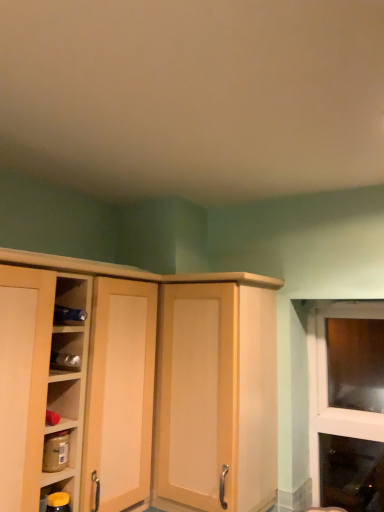
Describe the element at coordinates (196, 393) in the screenshot. Image resolution: width=384 pixels, height=512 pixels. I see `matte wood cabinet at center` at that location.

What are the coordinates of `yellow matte jar at lower left, the second shelf positioned from the top` in the screenshot? It's located at (54, 499).

Considering the relative sizes of yellow matte jar at lower left, the first shelf when ordered from bottom to top, and matte wood cupboard at left in the image provided, is yellow matte jar at lower left, the first shelf when ordered from bottom to top, smaller than matte wood cupboard at left?

Yes, yellow matte jar at lower left, the first shelf when ordered from bottom to top, is smaller than matte wood cupboard at left.

From a real-world perspective, which object stands above the other?

In real-world perspective, matte wood cupboard at left is above.

Is yellow matte jar at lower left, the second shelf positioned from the top, facing towards matte wood cupboard at left?

Yes, yellow matte jar at lower left, the second shelf positioned from the top, is aimed at matte wood cupboard at left.

Considering the relative sizes of yellow matte jar at lower left, the second shelf positioned from the top, and matte wood cupboard at left in the image provided, is yellow matte jar at lower left, the second shelf positioned from the top, thinner than matte wood cupboard at left?

Yes, yellow matte jar at lower left, the second shelf positioned from the top, is thinner than matte wood cupboard at left.

Considering the points (182, 501) and (65, 496), which point is in front, point (182, 501) or point (65, 496)?

Positioned in front is point (65, 496).

Is matte wood cabinet at center looking in the opposite direction of yellow matte jar at lower left, the first shelf when ordered from bottom to top?

No, matte wood cabinet at center is not facing the opposite direction of yellow matte jar at lower left, the first shelf when ordered from bottom to top.

Can you see matte wood cabinet at center touching yellow matte jar at lower left, the second shelf positioned from the top?

No.

Would you say matte wood cabinet at center is to the left or to the right of yellow matte jar at lower left, the second shelf positioned from the top, in the picture?

Clearly, matte wood cabinet at center is on the right of yellow matte jar at lower left, the second shelf positioned from the top, in the image.

Is matte wood cupboard at left facing away from yellow matte jar at lower left, the first shelf when ordered from bottom to top?

No, matte wood cupboard at left is not facing away from yellow matte jar at lower left, the first shelf when ordered from bottom to top.

Between matte wood cupboard at left and yellow matte jar at lower left, the second shelf positioned from the top, which one is positioned in front?

matte wood cupboard at left is more forward.

Considering the relative sizes of matte wood cupboard at left and yellow matte jar at lower left, the first shelf when ordered from bottom to top, in the image provided, is matte wood cupboard at left taller than yellow matte jar at lower left, the first shelf when ordered from bottom to top,?

Indeed, matte wood cupboard at left has a greater height compared to yellow matte jar at lower left, the first shelf when ordered from bottom to top.

Does matte brown jar at lower left, arranged as the 1th shelf when viewed from the top, have a smaller size compared to matte wood cupboard at left?

Yes, matte brown jar at lower left, arranged as the 1th shelf when viewed from the top, is smaller than matte wood cupboard at left.

Considering the relative positions of matte brown jar at lower left, the second shelf in the bottom-to-top sequence, and matte wood cupboard at left in the image provided, is matte brown jar at lower left, the second shelf in the bottom-to-top sequence, behind matte wood cupboard at left?

Yes, it is.

How much distance is there between matte brown jar at lower left, arranged as the 1th shelf when viewed from the top, and matte wood cupboard at left?

The distance of matte brown jar at lower left, arranged as the 1th shelf when viewed from the top, from matte wood cupboard at left is 14.16 inches.

Is matte brown jar at lower left, arranged as the 1th shelf when viewed from the top, not within matte wood cupboard at left?

Actually, matte brown jar at lower left, arranged as the 1th shelf when viewed from the top, is within matte wood cupboard at left.

From the picture: Between matte wood cabinet at center and matte brown jar at lower left, the second shelf in the bottom-to-top sequence, which one appears on the left side from the viewer's perspective?

From the viewer's perspective, matte brown jar at lower left, the second shelf in the bottom-to-top sequence, appears more on the left side.

Considering the sizes of objects matte wood cabinet at center and matte brown jar at lower left, the second shelf in the bottom-to-top sequence, in the image provided, who is smaller, matte wood cabinet at center or matte brown jar at lower left, the second shelf in the bottom-to-top sequence,?

matte brown jar at lower left, the second shelf in the bottom-to-top sequence.

Considering the relative sizes of matte wood cabinet at center and matte brown jar at lower left, the second shelf in the bottom-to-top sequence, in the image provided, is matte wood cabinet at center wider than matte brown jar at lower left, the second shelf in the bottom-to-top sequence,?

Indeed, matte wood cabinet at center has a greater width compared to matte brown jar at lower left, the second shelf in the bottom-to-top sequence.

Would you say matte wood cabinet at center contains matte brown jar at lower left, arranged as the 1th shelf when viewed from the top?

No, matte wood cabinet at center does not contain matte brown jar at lower left, arranged as the 1th shelf when viewed from the top.

Who is smaller, matte wood cupboard at left or matte wood cabinet at center?

Smaller between the two is matte wood cabinet at center.

Is matte wood cupboard at left not within matte wood cabinet at center?

matte wood cupboard at left is positioned outside matte wood cabinet at center.

The height and width of the screenshot is (512, 384). I want to click on screen door located behind the matte wood cupboard at left, so click(x=196, y=393).

From the image's perspective, who appears lower, matte brown jar at lower left, the second shelf in the bottom-to-top sequence, or matte wood cabinet at center?

matte brown jar at lower left, the second shelf in the bottom-to-top sequence, from the image's perspective.

Between matte brown jar at lower left, arranged as the 1th shelf when viewed from the top, and matte wood cabinet at center, which one appears on the right side from the viewer's perspective?

matte wood cabinet at center.

Is matte brown jar at lower left, the second shelf in the bottom-to-top sequence, facing towards matte wood cabinet at center?

No, matte brown jar at lower left, the second shelf in the bottom-to-top sequence, is not facing towards matte wood cabinet at center.

Find the location of `the 1st shelf in front of the matte wood cabinet at center, starting your count from the anchor`. the 1st shelf in front of the matte wood cabinet at center, starting your count from the anchor is located at coordinates pyautogui.click(x=55, y=477).

Where is `cupboard in front of the yellow matte jar at lower left, the first shelf when ordered from bottom to top`? Image resolution: width=384 pixels, height=512 pixels. cupboard in front of the yellow matte jar at lower left, the first shelf when ordered from bottom to top is located at coordinates coord(138,383).

The height and width of the screenshot is (512, 384). I want to click on screen door that is behind the yellow matte jar at lower left, the first shelf when ordered from bottom to top, so click(196, 393).

Estimate the real-world distances between objects in this image. Which object is closer to matte wood cabinet at center, matte brown jar at lower left, the second shelf in the bottom-to-top sequence, or matte wood cupboard at left?

Based on the image, matte wood cupboard at left appears to be nearer to matte wood cabinet at center.

Looking at the image, which one is located further to matte wood cupboard at left, matte wood cabinet at center or matte brown jar at lower left, arranged as the 1th shelf when viewed from the top?

The object further to matte wood cupboard at left is matte brown jar at lower left, arranged as the 1th shelf when viewed from the top.

Estimate the real-world distances between objects in this image. Which object is closer to yellow matte jar at lower left, the second shelf positioned from the top, matte wood cabinet at center or matte wood cupboard at left?

matte wood cupboard at left.

Estimate the real-world distances between objects in this image. Which object is closer to matte brown jar at lower left, arranged as the 1th shelf when viewed from the top, yellow matte jar at lower left, the second shelf positioned from the top, or matte wood cabinet at center?

yellow matte jar at lower left, the second shelf positioned from the top, lies closer to matte brown jar at lower left, arranged as the 1th shelf when viewed from the top, than the other object.

Based on their spatial positions, is matte wood cupboard at left or matte wood cabinet at center closer to matte brown jar at lower left, the second shelf in the bottom-to-top sequence?

Among the two, matte wood cupboard at left is located nearer to matte brown jar at lower left, the second shelf in the bottom-to-top sequence.

In the scene shown: Estimate the real-world distances between objects in this image. Which object is closer to matte wood cupboard at left, yellow matte jar at lower left, the second shelf positioned from the top, or matte brown jar at lower left, arranged as the 1th shelf when viewed from the top?

Based on the image, matte brown jar at lower left, arranged as the 1th shelf when viewed from the top, appears to be nearer to matte wood cupboard at left.

Considering their positions, is matte brown jar at lower left, the second shelf in the bottom-to-top sequence, positioned closer to matte wood cupboard at left than matte wood cabinet at center?

Based on the image, matte wood cabinet at center appears to be nearer to matte wood cupboard at left.

Based on their spatial positions, is matte wood cupboard at left or matte brown jar at lower left, the second shelf in the bottom-to-top sequence, closer to yellow matte jar at lower left, the first shelf when ordered from bottom to top?

The object closer to yellow matte jar at lower left, the first shelf when ordered from bottom to top, is matte brown jar at lower left, the second shelf in the bottom-to-top sequence.

This screenshot has height=512, width=384. Find the location of `shelf between matte brown jar at lower left, the second shelf in the bottom-to-top sequence, and matte wood cabinet at center from left to right`. shelf between matte brown jar at lower left, the second shelf in the bottom-to-top sequence, and matte wood cabinet at center from left to right is located at coordinates (54, 499).

The image size is (384, 512). In order to click on shelf between matte wood cupboard at left and matte brown jar at lower left, the second shelf in the bottom-to-top sequence, in the front-back direction in this screenshot , I will do `click(54, 499)`.